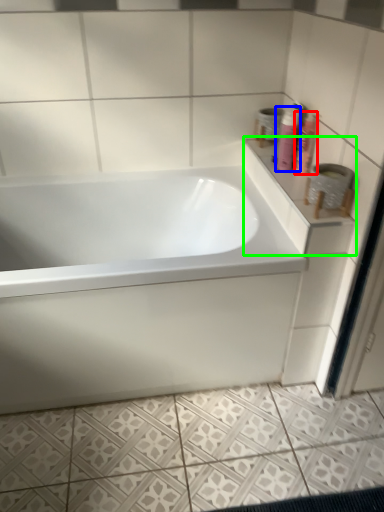
Question: Which object is positioned farthest from shaving cream (highlighted by a red box)? Select from shaving cream (highlighted by a blue box) and counter top (highlighted by a green box).

Choices:
 (A) shaving cream
 (B) counter top

Answer: (B)